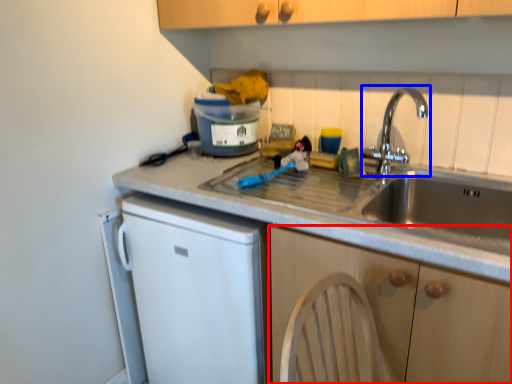
Question: Which of the following is the closest to the observer, cabinetry (highlighted by a red box) or tap (highlighted by a blue box)?

Choices:
 (A) cabinetry
 (B) tap

Answer: (A)